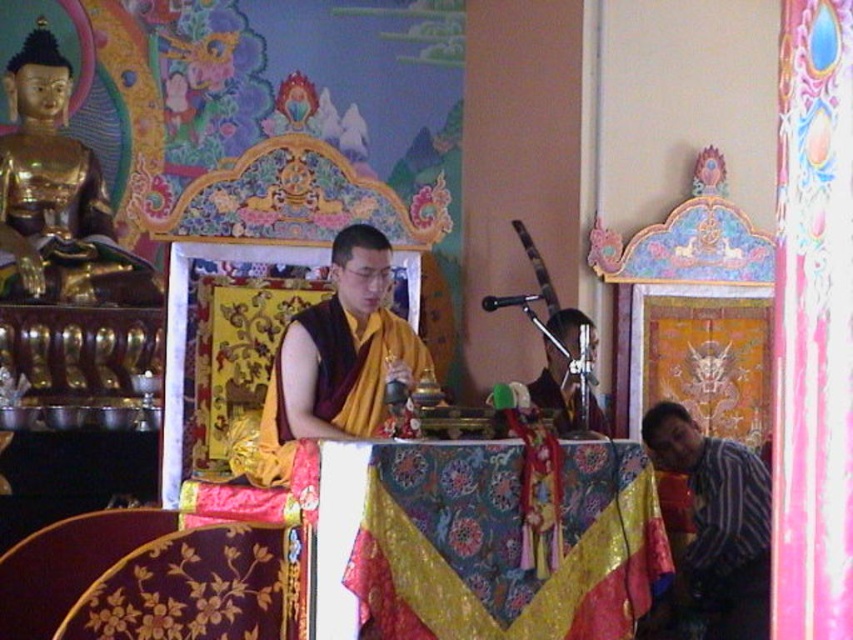
Between point (368, 352) and point (714, 534), which one is positioned in front?

Point (368, 352) is more forward.

Locate an element on the screen. This screenshot has height=640, width=853. yellow silk monk at center is located at coordinates (338, 356).

The image size is (853, 640). Find the location of `yellow silk monk at center`. yellow silk monk at center is located at coordinates (338, 356).

Is point (380, 259) behind point (602, 426)?

No, (380, 259) is in front of (602, 426).

Is yellow silk monk at center to the left of silky yellow robe at center from the viewer's perspective?

Indeed, yellow silk monk at center is positioned on the left side of silky yellow robe at center.

Between point (294, 394) and point (567, 410), which one is positioned behind?

The point (567, 410) is behind.

Locate an element on the screen. yellow silk monk at center is located at coordinates (338, 356).

Who is more distant from viewer, (22, 67) or (267, 401)?

Positioned behind is point (22, 67).

Does gold polished statue at upper left have a greater width compared to yellow silk monk at center?

Yes.

What do you see at coordinates (57, 196) in the screenshot?
I see `gold polished statue at upper left` at bounding box center [57, 196].

The image size is (853, 640). I want to click on gold polished statue at upper left, so click(x=57, y=196).